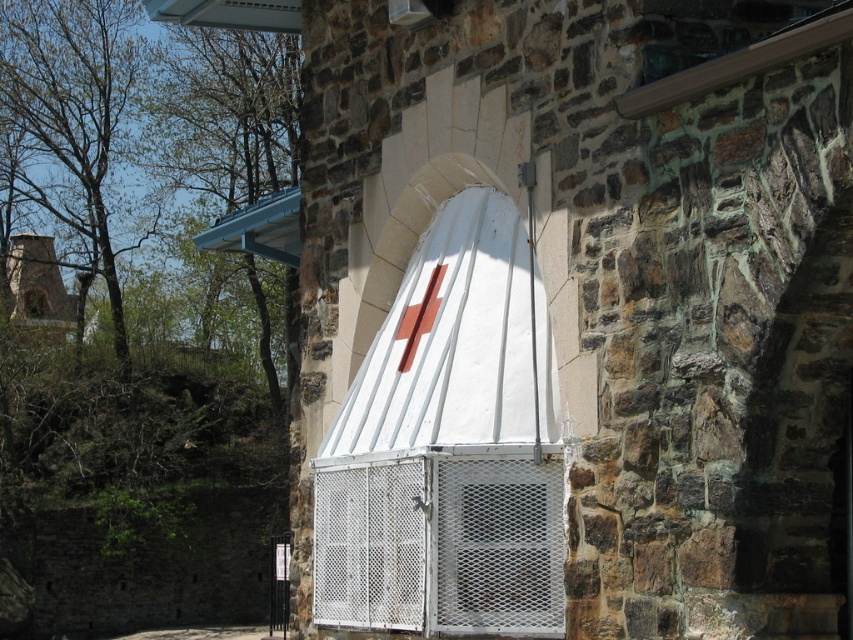
You are a painter hired to paint the brick chimney at left and the white mesh window at center. If you want to reach the top of both objects with a ladder, which one will require a taller ladder?

The brick chimney at left is much taller than the white mesh window at center, so you will need a taller ladder for the brick chimney at left.

You are a painter hired to paint both the brick chimney at left and the white mesh window at center. You have a limited amount of paint. Which object requires more paint due to its size?

The brick chimney at left requires more paint because it is larger in size than the white mesh window at center.

You are standing at the base of the brick chimney at left. You want to take a photo of the camera that is 110.98 meters away. Is the camera within the range of a typical consumer camera lens? Explain.

The camera is 110.98 meters away from the brick chimney at left. A typical consumer camera lens has a maximum focusing distance of around 100 meters. Therefore, the camera may be slightly out of focus or require a specialized lens to capture clearly.